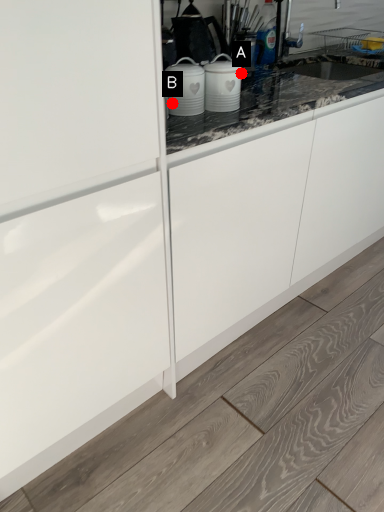
Question: Two points are circled on the image, labeled by A and B beside each circle. Which point is closer to the camera?

Choices:
 (A) A is closer
 (B) B is closer

Answer: (B)